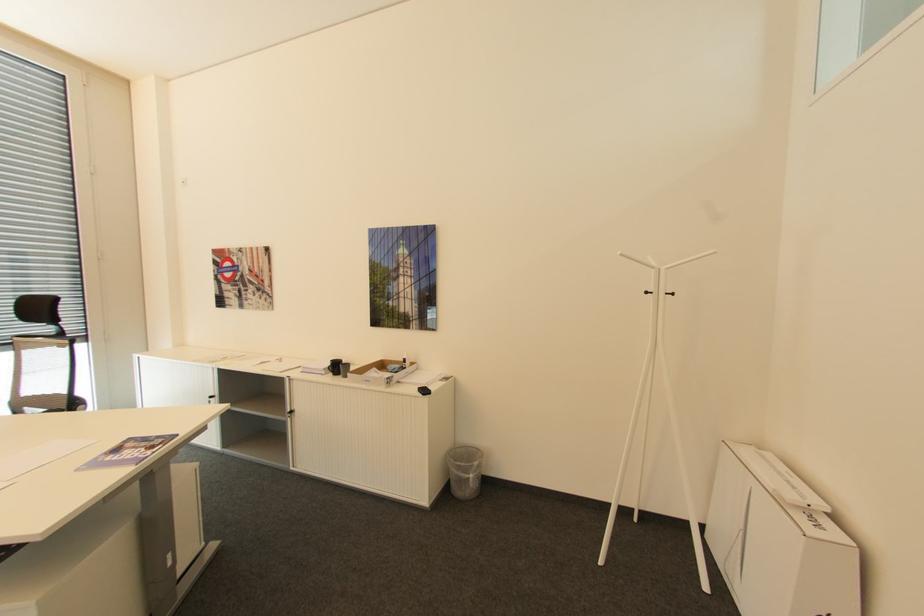
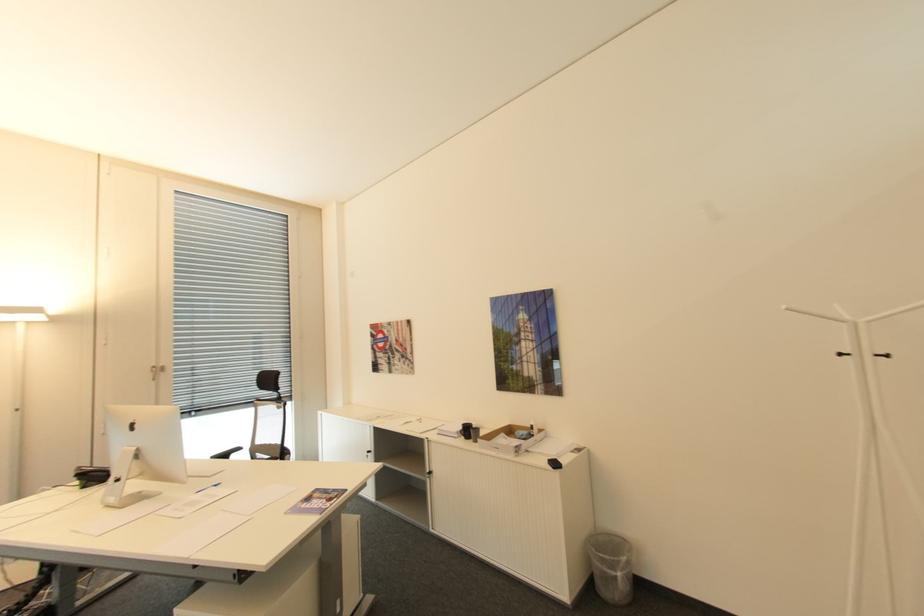
Where in the second image is the point corresponding to [30,394] from the first image?

(261, 442)